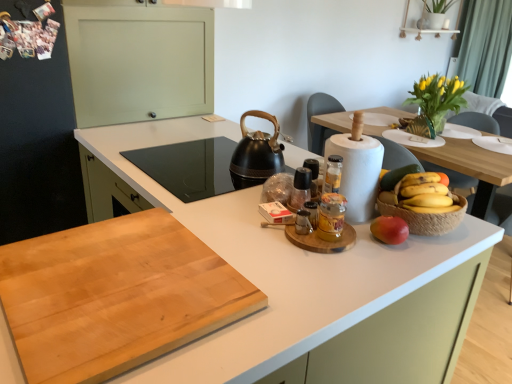
Question: From a real-world perspective, is translucent glass jar at center, which is counted as the 1th bottle, starting from the front, physically above green fabric curtain at upper right?

Choices:
 (A) no
 (B) yes

Answer: (A)

Question: Can you confirm if translucent glass jar at center, which is counted as the 1th bottle, starting from the front, is smaller than green fabric curtain at upper right?

Choices:
 (A) yes
 (B) no

Answer: (A)

Question: Does translucent glass jar at center, which is counted as the 1th bottle, starting from the front, touch green fabric curtain at upper right?

Choices:
 (A) yes
 (B) no

Answer: (B)

Question: Does translucent glass jar at center, which is the 2th bottle from back to front, lie behind green fabric curtain at upper right?

Choices:
 (A) no
 (B) yes

Answer: (A)

Question: Considering the relative positions of translucent glass jar at center, which is counted as the 1th bottle, starting from the front, and green fabric curtain at upper right in the image provided, is translucent glass jar at center, which is counted as the 1th bottle, starting from the front, to the left of green fabric curtain at upper right from the viewer's perspective?

Choices:
 (A) no
 (B) yes

Answer: (B)

Question: From a real-world perspective, is green fabric curtain at upper right above or below white matte countertop at center, the second countertop positioned from the top?

Choices:
 (A) below
 (B) above

Answer: (B)

Question: In terms of width, does green fabric curtain at upper right look wider or thinner when compared to white matte countertop at center, acting as the first countertop starting from the bottom?

Choices:
 (A) thin
 (B) wide

Answer: (A)

Question: Looking at the image, does green fabric curtain at upper right seem bigger or smaller compared to white matte countertop at center, the second countertop positioned from the top?

Choices:
 (A) big
 (B) small

Answer: (B)

Question: Considering the positions of green fabric curtain at upper right and white matte countertop at center, acting as the first countertop starting from the bottom, in the image, is green fabric curtain at upper right taller or shorter than white matte countertop at center, acting as the first countertop starting from the bottom,?

Choices:
 (A) tall
 (B) short

Answer: (A)

Question: Considering the positions of black rubberized kettle at center and natural wood cutting board at center, the second countertop from the bottom, in the image, is black rubberized kettle at center wider or thinner than natural wood cutting board at center, the second countertop from the bottom,?

Choices:
 (A) wide
 (B) thin

Answer: (B)

Question: Is black rubberized kettle at center to the left or to the right of natural wood cutting board at center, the second countertop from the bottom, in the image?

Choices:
 (A) right
 (B) left

Answer: (A)

Question: Choose the correct answer: Is black rubberized kettle at center inside natural wood cutting board at center, the second countertop from the bottom, or outside it?

Choices:
 (A) outside
 (B) inside

Answer: (A)

Question: Is point (253, 160) positioned closer to the camera than point (10, 246)?

Choices:
 (A) farther
 (B) closer

Answer: (A)

Question: From a real-world perspective, is green matte grapefruit at right above or below black rubberized kettle at center?

Choices:
 (A) above
 (B) below

Answer: (B)

Question: In terms of width, does green matte grapefruit at right look wider or thinner when compared to black rubberized kettle at center?

Choices:
 (A) wide
 (B) thin

Answer: (B)